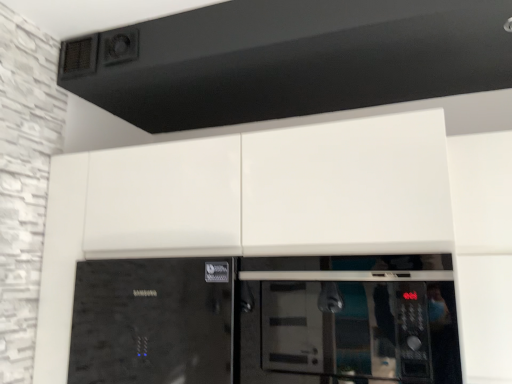
At what (x,y) coordinates should I click in order to perform the action: click on glossy white cabinet at center. Please return your answer as a coordinate pair (x, y). This screenshot has height=384, width=512. Looking at the image, I should click on (266, 192).

Is black textured exhaust hood at upper center not close to black glass microwave at center?

black textured exhaust hood at upper center is actually quite close to black glass microwave at center.

From the image's perspective, which is below, black textured exhaust hood at upper center or black glass microwave at center?

black glass microwave at center is shown below in the image.

Considering the positions of point (259, 35) and point (100, 271), is point (259, 35) closer or farther from the camera than point (100, 271)?

Point (259, 35) appears to be closer to the viewer than point (100, 271).

Is black textured exhaust hood at upper center to the right of black glass microwave at center from the viewer's perspective?

No, black textured exhaust hood at upper center is not to the right of black glass microwave at center.

Does glossy white cabinet at center have a lesser width compared to black glass microwave at center?

No.

Which of these two, glossy white cabinet at center or black glass microwave at center, is smaller?

black glass microwave at center is smaller.

From the image's perspective, is glossy white cabinet at center located above or below black glass microwave at center?

From the image's perspective, glossy white cabinet at center appears above black glass microwave at center.

Considering the relative sizes of glossy white cabinet at center and black glass microwave at center in the image provided, is glossy white cabinet at center taller than black glass microwave at center?

Yes, glossy white cabinet at center is taller than black glass microwave at center.

In the scene shown: Measure the distance from glossy white cabinet at center to black textured exhaust hood at upper center.

17.44 inches.

Between glossy white cabinet at center and black textured exhaust hood at upper center, which one appears on the left side from the viewer's perspective?

glossy white cabinet at center is more to the left.

Is point (136, 185) behind point (474, 48)?

Yes, point (136, 185) is farther from viewer.

Between glossy white cabinet at center and black textured exhaust hood at upper center, which one has larger width?

Wider between the two is black textured exhaust hood at upper center.

Is black glass microwave at center positioned behind black textured exhaust hood at upper center?

No, black glass microwave at center is closer to the viewer.

Image resolution: width=512 pixels, height=384 pixels. What are the coordinates of `exhaust hood located behind the black glass microwave at center` in the screenshot? It's located at (290, 60).

From a real-world perspective, does black glass microwave at center stand above black textured exhaust hood at upper center?

No.

Between black glass microwave at center and black textured exhaust hood at upper center, which one has more height?

With more height is black glass microwave at center.

Do you think black textured exhaust hood at upper center is within glossy white cabinet at center, or outside of it?

black textured exhaust hood at upper center is located beyond the bounds of glossy white cabinet at center.

Locate an element on the screen. cabinetry on the left of black textured exhaust hood at upper center is located at coordinates (266, 192).

From their relative heights in the image, would you say black textured exhaust hood at upper center is taller or shorter than glossy white cabinet at center?

Clearly, black textured exhaust hood at upper center is shorter compared to glossy white cabinet at center.

Considering the positions of points (265, 18) and (400, 228), is point (265, 18) closer to camera compared to point (400, 228)?

No, (265, 18) is behind (400, 228).

Considering their positions, is black glass microwave at center located in front of or behind glossy white cabinet at center?

black glass microwave at center is positioned farther from the viewer than glossy white cabinet at center.

Is black glass microwave at center touching glossy white cabinet at center?

There is a gap between black glass microwave at center and glossy white cabinet at center.

What's the angular difference between black glass microwave at center and glossy white cabinet at center's facing directions?

The angle between the facing direction of black glass microwave at center and the facing direction of glossy white cabinet at center is 0.973 degrees.

Does black glass microwave at center turn towards glossy white cabinet at center?

Yes, black glass microwave at center is turned towards glossy white cabinet at center.

This screenshot has width=512, height=384. What are the coordinates of `exhaust hood above the black glass microwave at center (from the image's perspective)` in the screenshot? It's located at (290, 60).

Locate an element on the screen. cabinetry in front of the black glass microwave at center is located at coordinates (266, 192).

From the image, which object appears to be farther from black glass microwave at center, glossy white cabinet at center or black textured exhaust hood at upper center?

black textured exhaust hood at upper center is further to black glass microwave at center.

When comparing their distances from black glass microwave at center, does black textured exhaust hood at upper center or glossy white cabinet at center seem further?

The object further to black glass microwave at center is black textured exhaust hood at upper center.

Looking at the image, which one is located closer to black textured exhaust hood at upper center, black glass microwave at center or glossy white cabinet at center?

Among the two, glossy white cabinet at center is located nearer to black textured exhaust hood at upper center.

Based on their spatial positions, is black glass microwave at center or black textured exhaust hood at upper center closer to glossy white cabinet at center?

black glass microwave at center is positioned closer to the anchor glossy white cabinet at center.

Looking at the image, which one is located closer to black textured exhaust hood at upper center, glossy white cabinet at center or black glass microwave at center?

glossy white cabinet at center is closer to black textured exhaust hood at upper center.

Which object lies further to the anchor point glossy white cabinet at center, black textured exhaust hood at upper center or black glass microwave at center?

The object further to glossy white cabinet at center is black textured exhaust hood at upper center.

At what (x,y) coordinates should I click in order to perform the action: click on cabinetry between black textured exhaust hood at upper center and black glass microwave at center in the up-down direction. Please return your answer as a coordinate pair (x, y). The height and width of the screenshot is (384, 512). Looking at the image, I should click on (266, 192).